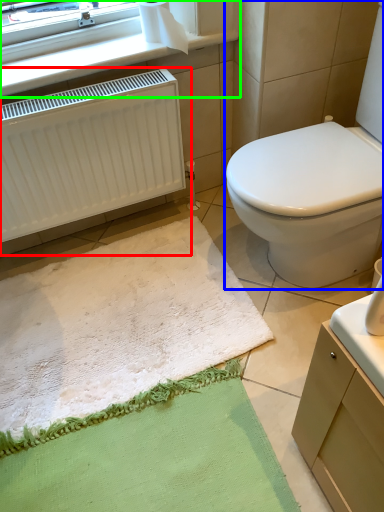
Question: Considering the real-world distances, which object is farthest from radiator (highlighted by a red box)? toilet (highlighted by a blue box) or window frame (highlighted by a green box)?

Choices:
 (A) toilet
 (B) window frame

Answer: (A)